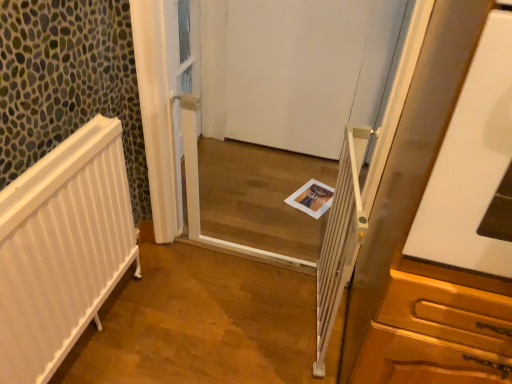
Locate an element on the screen. free region under white plastic balustrade at center (from a real-world perspective) is located at coordinates (315, 326).